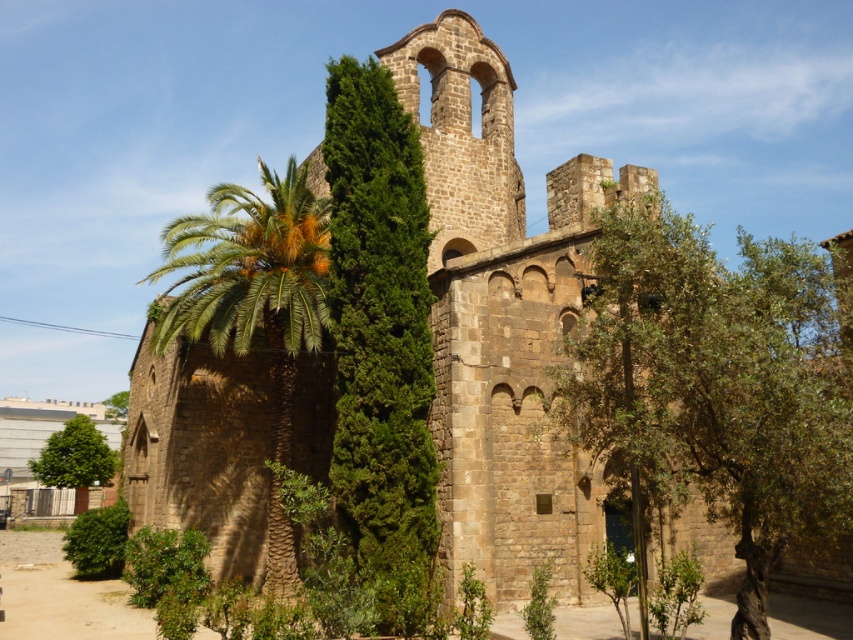
At what (x,y) coordinates should I click in order to perform the action: click on green textured tree at center. Please return your answer as a coordinate pair (x, y). This screenshot has height=640, width=853. Looking at the image, I should click on (381, 344).

What do you see at coordinates (381, 344) in the screenshot? The image size is (853, 640). I see `green textured tree at center` at bounding box center [381, 344].

Where is `green textured tree at center`? The image size is (853, 640). green textured tree at center is located at coordinates (381, 344).

Can you confirm if green leafy tree at right is taller than green leafy palm at left?

In fact, green leafy tree at right may be shorter than green leafy palm at left.

In the scene shown: Between green leafy tree at right and green leafy palm at left, which one appears on the left side from the viewer's perspective?

From the viewer's perspective, green leafy palm at left appears more on the left side.

What do you see at coordinates (717, 385) in the screenshot?
I see `green leafy tree at right` at bounding box center [717, 385].

Where is `green leafy tree at right`? The image size is (853, 640). green leafy tree at right is located at coordinates click(x=717, y=385).

Is green leafy tree at right wider than green textured tree at center?

Yes, green leafy tree at right is wider than green textured tree at center.

Can you confirm if green leafy tree at right is positioned above green textured tree at center?

Indeed, green leafy tree at right is positioned over green textured tree at center.

Who is more distant from viewer, [741,544] or [386,493]?

Positioned behind is point [386,493].

The height and width of the screenshot is (640, 853). I want to click on green leafy tree at right, so click(x=717, y=385).